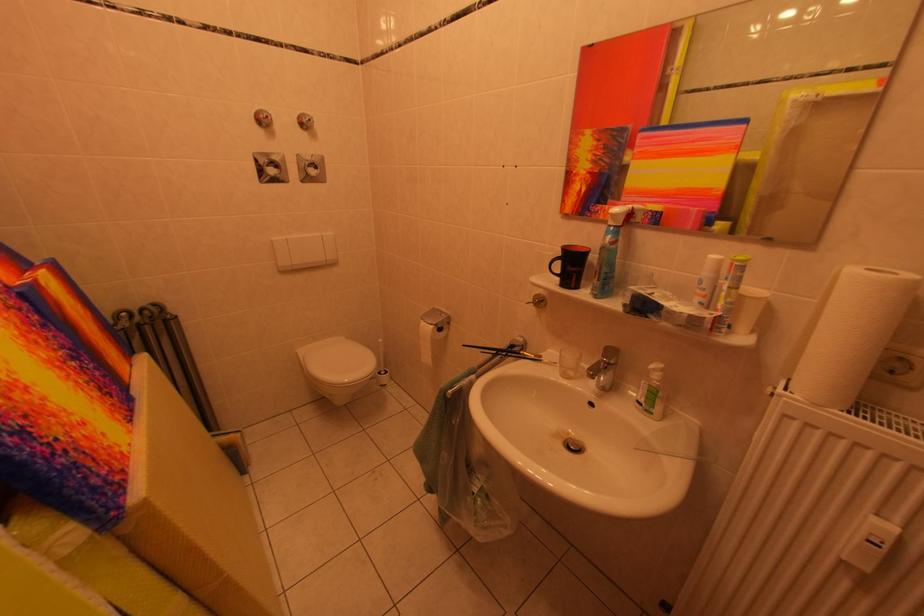
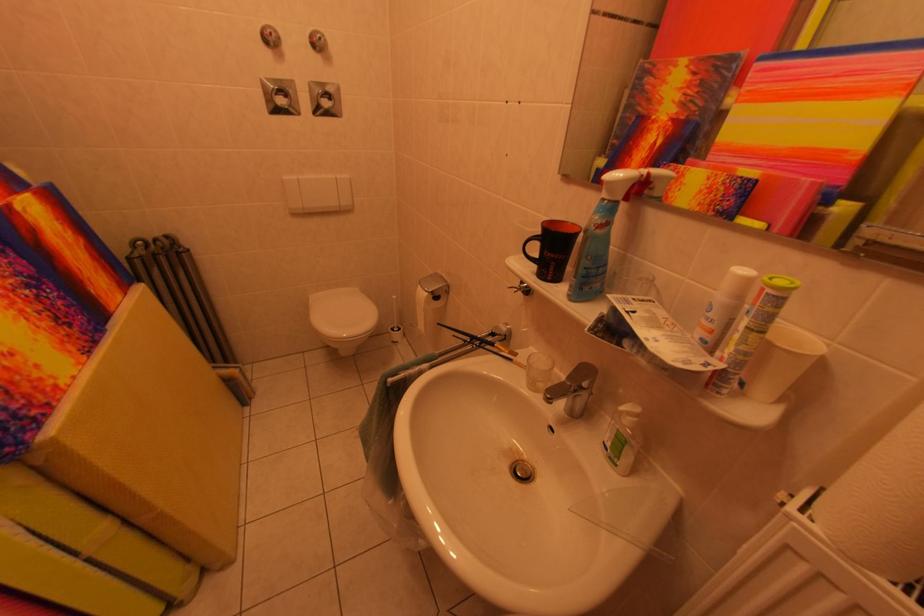
Find the pixel in the second image that matches point 727,317 in the first image.

(732, 370)